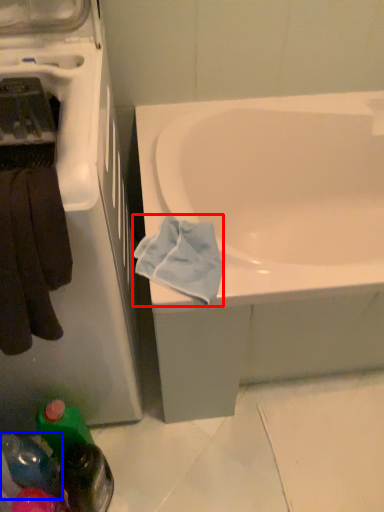
Question: Which point is closer to the camera, bath towel (highlighted by a red box) or bottle (highlighted by a blue box)?

Choices:
 (A) bath towel
 (B) bottle

Answer: (A)